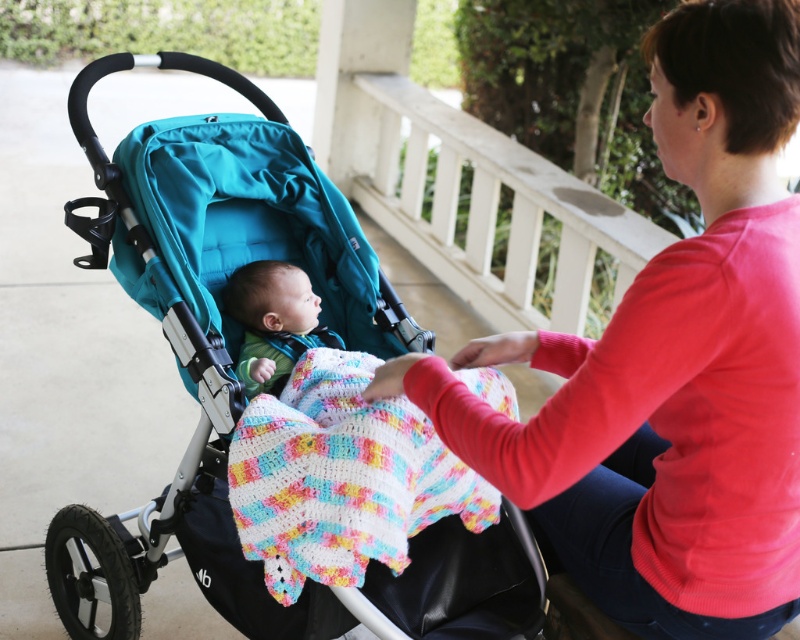
Question: Is multicolored crocheted blanket at center closer to camera compared to soft green knit sweater at center?

Choices:
 (A) no
 (B) yes

Answer: (B)

Question: Is teal fabric stroller at left to the left of multicolored crocheted blanket at center from the viewer's perspective?

Choices:
 (A) no
 (B) yes

Answer: (B)

Question: Which object is closer to the camera taking this photo?

Choices:
 (A) matte red sweater at center
 (B) teal fabric stroller at left
 (C) multicolored crocheted blanket at center

Answer: (A)

Question: Which of these objects is positioned closest to the matte red sweater at center?

Choices:
 (A) teal fabric stroller at left
 (B) multicolored crocheted blanket at center
 (C) soft green knit sweater at center

Answer: (B)

Question: Considering the real-world distances, which object is farthest from the teal fabric stroller at left?

Choices:
 (A) multicolored crocheted blanket at center
 (B) soft green knit sweater at center

Answer: (A)

Question: Is matte red sweater at center bigger than teal fabric stroller at left?

Choices:
 (A) yes
 (B) no

Answer: (B)